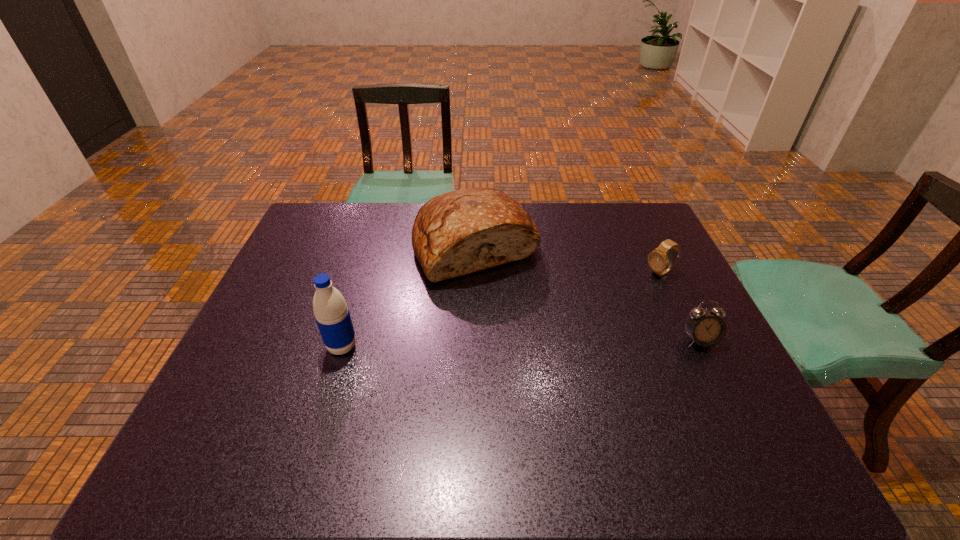
Identify the location of the leftmost object. (332, 315).

Locate an element on the screen. This screenshot has width=960, height=540. alarm clock is located at coordinates (705, 328).

This screenshot has height=540, width=960. In order to click on bread in this screenshot , I will do `click(456, 233)`.

Locate an element on the screen. the second tallest object is located at coordinates (456, 233).

You are a GUI agent. You are given a task and a screenshot of the screen. Output one action in this format:
    pyautogui.click(x=<x>, y=<y>)
    Task: Click on the watch
    
    Given the screenshot: What is the action you would take?
    (660, 263)

Identify the location of vacant space located on the front of the leftmost object. The height and width of the screenshot is (540, 960). (319, 422).

Locate an element on the screen. The height and width of the screenshot is (540, 960). vacant area situated on the face of the alarm clock is located at coordinates (736, 416).

This screenshot has width=960, height=540. Find the location of `vacant space situated at the sliced front of the third object from right to left`. vacant space situated at the sliced front of the third object from right to left is located at coordinates (526, 348).

Locate an element on the screen. free point located 0.170m at the sliced front of the third object from right to left is located at coordinates (516, 328).

Find the location of a particular element. The image size is (960, 540). blank space located at the sliced front of the third object from right to left is located at coordinates (x=551, y=398).